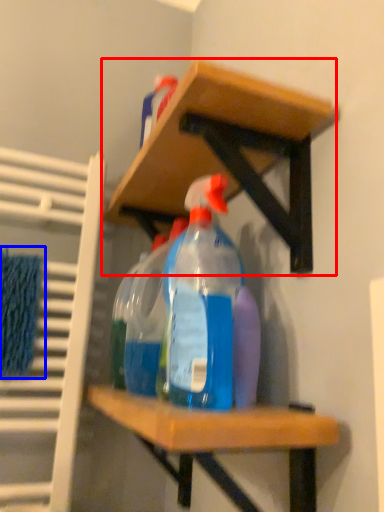
Question: Which of the following is the farthest to the observer, shelf (highlighted by a red box) or bath towel (highlighted by a blue box)?

Choices:
 (A) shelf
 (B) bath towel

Answer: (B)